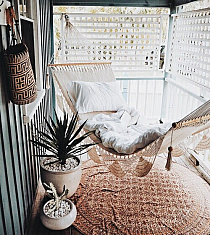
Where is `tassel`? The image size is (210, 235). tassel is located at coordinates (169, 158).